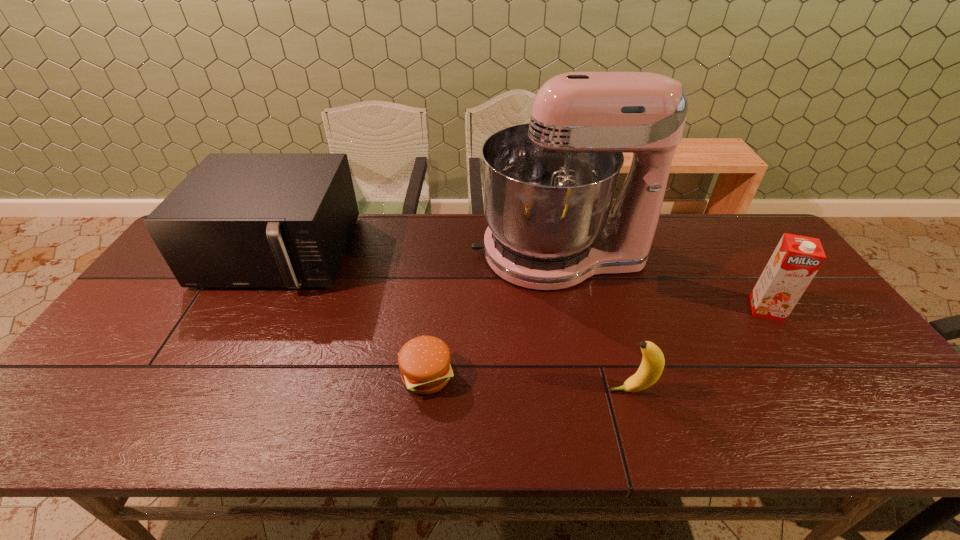
Image resolution: width=960 pixels, height=540 pixels. Identify the location of the tallest object. (548, 186).

Locate an element on the screen. This screenshot has width=960, height=540. microwave oven is located at coordinates (239, 220).

Where is `carton`? Image resolution: width=960 pixels, height=540 pixels. carton is located at coordinates (796, 260).

Locate an element on the screen. the fourth tallest object is located at coordinates (652, 365).

Locate an element on the screen. This screenshot has width=960, height=540. the shortest object is located at coordinates (424, 362).

Identify the location of the second object from left to right. (424, 362).

Locate an element on the screen. Image resolution: width=960 pixels, height=540 pixels. vacant area situated 0.150m on the front-facing side of the mixer is located at coordinates (424, 254).

Image resolution: width=960 pixels, height=540 pixels. I want to click on free space located 0.150m on the front-facing side of the mixer, so click(424, 254).

Find the location of `free space located on the front-facing side of the mixer`. free space located on the front-facing side of the mixer is located at coordinates (437, 254).

At what (x,y) coordinates should I click in order to perform the action: click on vacant space located 0.390m on the front-facing side of the leftmost object. Please return your answer as a coordinate pair (x, y). Image resolution: width=960 pixels, height=540 pixels. Looking at the image, I should click on (187, 425).